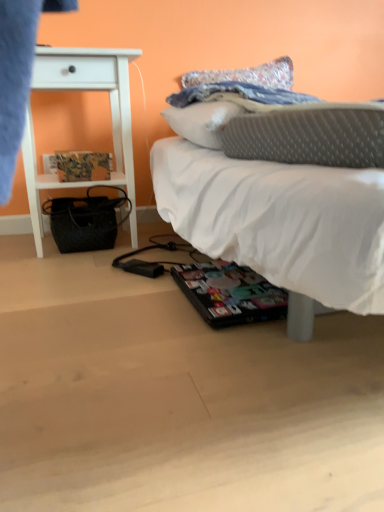
Question: Can you confirm if white wood nightstand at left is positioned to the right of printed paper magazine at left?

Choices:
 (A) yes
 (B) no

Answer: (B)

Question: From the image's perspective, is white wood nightstand at left located above printed paper magazine at left?

Choices:
 (A) no
 (B) yes

Answer: (B)

Question: Does white wood nightstand at left have a lesser height compared to printed paper magazine at left?

Choices:
 (A) yes
 (B) no

Answer: (B)

Question: Could you tell me if white wood nightstand at left is turned towards printed paper magazine at left?

Choices:
 (A) yes
 (B) no

Answer: (A)

Question: Can you confirm if white wood nightstand at left is bigger than printed paper magazine at left?

Choices:
 (A) yes
 (B) no

Answer: (A)

Question: From a real-world perspective, is white soft bed at center physically located above or below white wood nightstand at left?

Choices:
 (A) below
 (B) above

Answer: (A)

Question: In terms of height, does white soft bed at center look taller or shorter compared to white wood nightstand at left?

Choices:
 (A) short
 (B) tall

Answer: (A)

Question: Is point (165, 164) closer or farther from the camera than point (34, 195)?

Choices:
 (A) closer
 (B) farther

Answer: (A)

Question: In terms of size, does white soft bed at center appear bigger or smaller than white wood nightstand at left?

Choices:
 (A) big
 (B) small

Answer: (A)

Question: Which is correct: white soft bed at center is inside printed paper magazine at left, or outside of it?

Choices:
 (A) inside
 (B) outside

Answer: (B)

Question: Considering the positions of white soft bed at center and printed paper magazine at left in the image, is white soft bed at center bigger or smaller than printed paper magazine at left?

Choices:
 (A) big
 (B) small

Answer: (A)

Question: Does point (292, 286) appear closer or farther from the camera than point (79, 155)?

Choices:
 (A) closer
 (B) farther

Answer: (A)

Question: From a real-world perspective, is white soft bed at center positioned above or below printed paper magazine at left?

Choices:
 (A) above
 (B) below

Answer: (B)

Question: Choose the correct answer: Is white wood nightstand at left inside printed paper magazine at left or outside it?

Choices:
 (A) outside
 (B) inside

Answer: (A)

Question: In the image, is white wood nightstand at left positioned in front of or behind printed paper magazine at left?

Choices:
 (A) behind
 (B) front

Answer: (B)